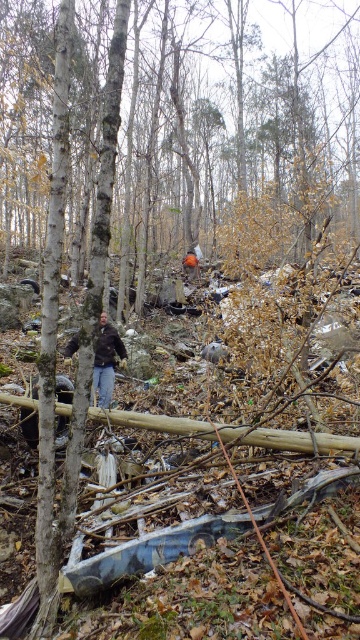
Can you confirm if dark brown leather jacket at center is wider than orange fabric person at center?

No, dark brown leather jacket at center is not wider than orange fabric person at center.

Between point (114, 348) and point (195, 256), which one is positioned behind?

Point (195, 256)

Which is behind, point (96, 387) or point (186, 269)?

The point (186, 269) is behind.

Where is `dark brown leather jacket at center`? This screenshot has height=640, width=360. dark brown leather jacket at center is located at coordinates (106, 360).